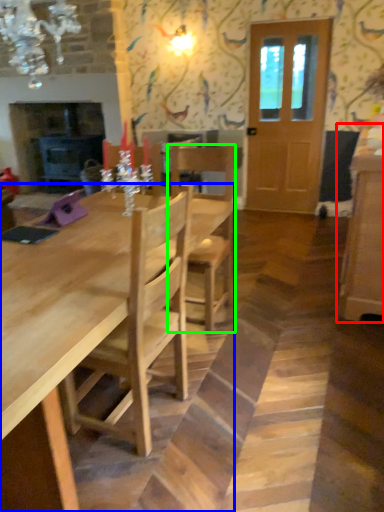
Question: Which object is the farthest from cabinetry (highlighted by a red box)? Choose among these: kitchen & dining room table (highlighted by a blue box) or chair (highlighted by a green box).

Choices:
 (A) kitchen & dining room table
 (B) chair

Answer: (A)